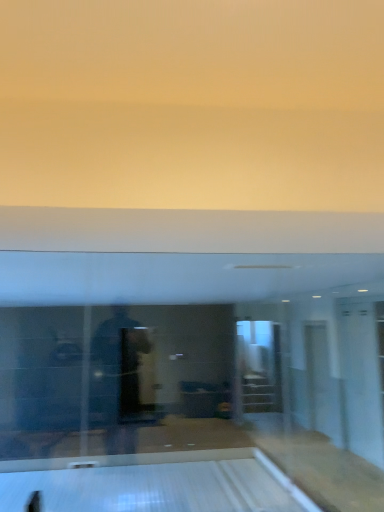
Image resolution: width=384 pixels, height=512 pixels. I want to click on white glossy bowling alley at lower center, so click(x=155, y=483).

The height and width of the screenshot is (512, 384). What do you see at coordinates (155, 483) in the screenshot?
I see `white glossy bowling alley at lower center` at bounding box center [155, 483].

At what (x,y) coordinates should I click in order to perform the action: click on transparent glass door at right. Please return your answer as a coordinate pair (x, y). This screenshot has width=384, height=512. Looking at the image, I should click on (363, 376).

Based on the photo, what is the approximate width of transparent glass door at right?

The width of transparent glass door at right is 25.37 inches.

This screenshot has width=384, height=512. What do you see at coordinates (363, 376) in the screenshot? I see `transparent glass door at right` at bounding box center [363, 376].

Locate an element on the screen. This screenshot has height=512, width=384. white glossy bowling alley at lower center is located at coordinates (x=155, y=483).

Between white glossy bowling alley at lower center and transparent glass door at right, which one appears on the right side from the viewer's perspective?

transparent glass door at right is more to the right.

Relative to transparent glass door at right, is white glossy bowling alley at lower center in front or behind?

white glossy bowling alley at lower center is in front of transparent glass door at right.

Does point (220, 451) appear closer or farther from the camera than point (357, 446)?

Point (220, 451) is positioned closer to the camera compared to point (357, 446).

From the image's perspective, which one is positioned higher, white glossy bowling alley at lower center or transparent glass door at right?

transparent glass door at right, from the image's perspective.

From a real-world perspective, between white glossy bowling alley at lower center and transparent glass door at right, who is vertically higher?

From a 3D spatial view, transparent glass door at right is above.

Considering the relative sizes of white glossy bowling alley at lower center and transparent glass door at right in the image provided, is white glossy bowling alley at lower center wider than transparent glass door at right?

Yes, white glossy bowling alley at lower center is wider than transparent glass door at right.

Based on the photo, which of these two, white glossy bowling alley at lower center or transparent glass door at right, stands taller?

transparent glass door at right.

Which of these two, white glossy bowling alley at lower center or transparent glass door at right, is bigger?

transparent glass door at right is bigger.

Do you think white glossy bowling alley at lower center is within transparent glass door at right, or outside of it?

white glossy bowling alley at lower center lies outside transparent glass door at right.

Is white glossy bowling alley at lower center touching transparent glass door at right?

No, white glossy bowling alley at lower center is not making contact with transparent glass door at right.

Could you tell me if white glossy bowling alley at lower center is turned towards transparent glass door at right?

No, white glossy bowling alley at lower center does not turn towards transparent glass door at right.

You are a GUI agent. You are given a task and a screenshot of the screen. Output one action in this format:
    pyautogui.click(x=<x>, y=<y>)
    Task: Click on the bowling alley below the transparent glass door at right (from the image's perspective)
    The height and width of the screenshot is (512, 384).
    Given the screenshot: What is the action you would take?
    pyautogui.click(x=155, y=483)

Considering the positions of objects transparent glass door at right and white glossy bowling alley at lower center in the image provided, who is more to the right, transparent glass door at right or white glossy bowling alley at lower center?

transparent glass door at right.

Which object is closer to the camera, transparent glass door at right or white glossy bowling alley at lower center?

Positioned in front is white glossy bowling alley at lower center.

Between point (359, 312) and point (255, 458), which one is positioned in front?

Point (255, 458)

From the image's perspective, is transparent glass door at right positioned above or below white glossy bowling alley at lower center?

Based on their image positions, transparent glass door at right is located above white glossy bowling alley at lower center.

From a real-world perspective, which is physically above, transparent glass door at right or white glossy bowling alley at lower center?

transparent glass door at right, from a real-world perspective.

Considering the relative sizes of transparent glass door at right and white glossy bowling alley at lower center in the image provided, is transparent glass door at right wider than white glossy bowling alley at lower center?

No.

Considering the sizes of objects transparent glass door at right and white glossy bowling alley at lower center in the image provided, who is taller, transparent glass door at right or white glossy bowling alley at lower center?

With more height is transparent glass door at right.

Can you confirm if transparent glass door at right is smaller than white glossy bowling alley at lower center?

No.

Can white glossy bowling alley at lower center be found inside transparent glass door at right?

That's incorrect, white glossy bowling alley at lower center is not inside transparent glass door at right.

Is transparent glass door at right beside white glossy bowling alley at lower center?

No, transparent glass door at right is not making contact with white glossy bowling alley at lower center.

Is transparent glass door at right facing away from white glossy bowling alley at lower center?

No, white glossy bowling alley at lower center is not at the back of transparent glass door at right.

How distant is transparent glass door at right from white glossy bowling alley at lower center?

The distance of transparent glass door at right from white glossy bowling alley at lower center is 2.00 meters.

What are the coordinates of `bowling alley on the left of transparent glass door at right` in the screenshot? It's located at (155, 483).

What are the coordinates of `bowling alley that is below the transparent glass door at right (from the image's perspective)` in the screenshot? It's located at (155, 483).

Where is `bowling alley lying on the left of transparent glass door at right`? Image resolution: width=384 pixels, height=512 pixels. bowling alley lying on the left of transparent glass door at right is located at coordinates pos(155,483).